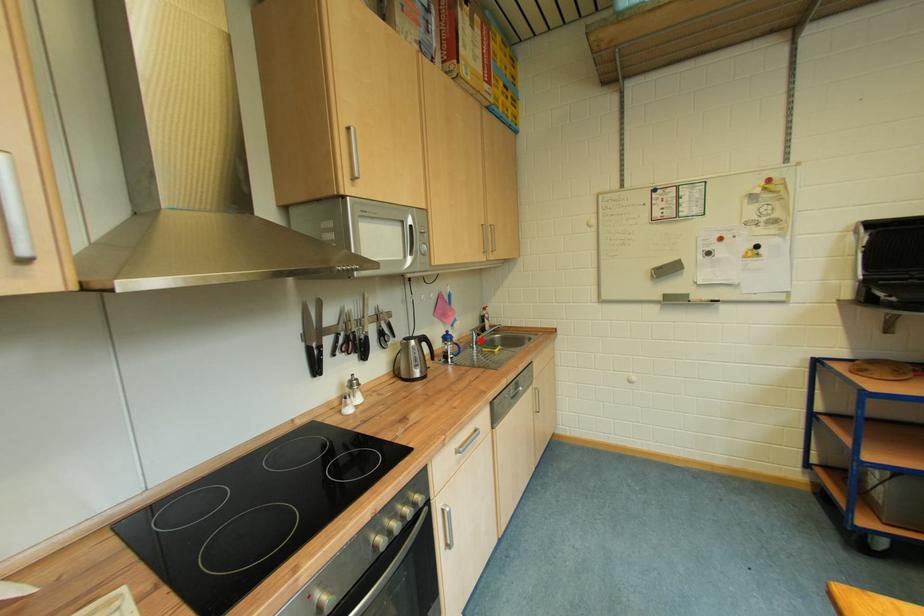
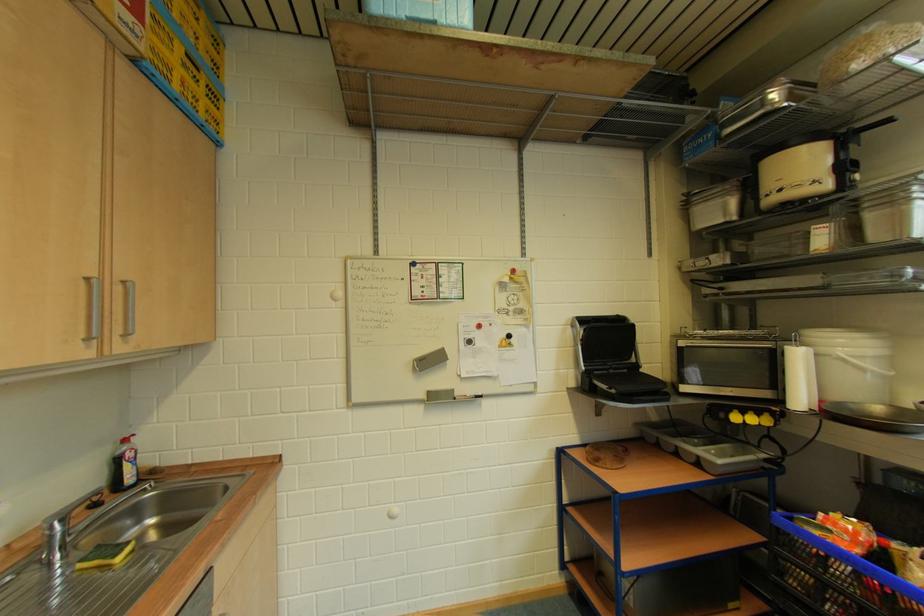
In the second image, find the point that corresponds to the highlighted location in the first image.

(61, 539)